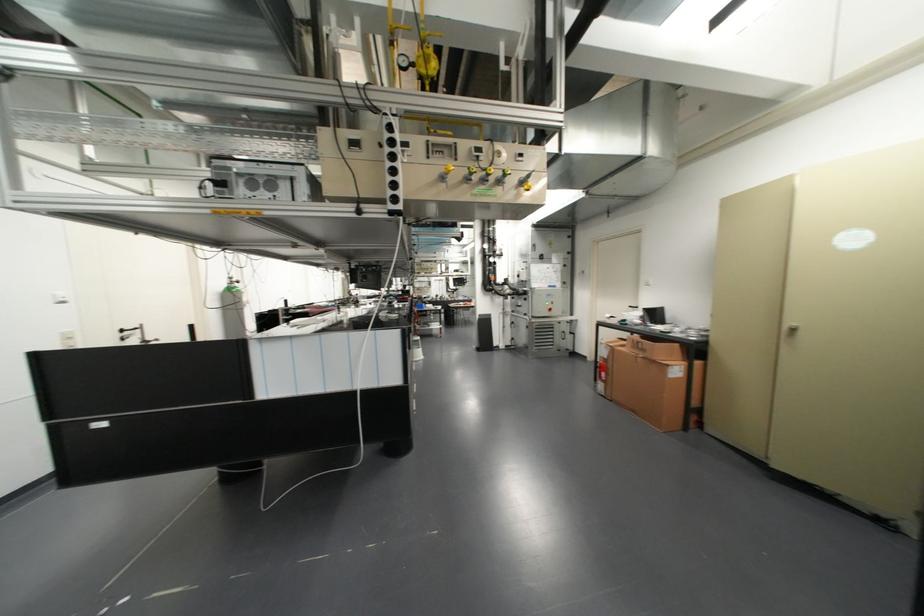
Describe the element at coordinates (505, 172) in the screenshot. The width and height of the screenshot is (924, 616). I see `the yellow toggle switch` at that location.